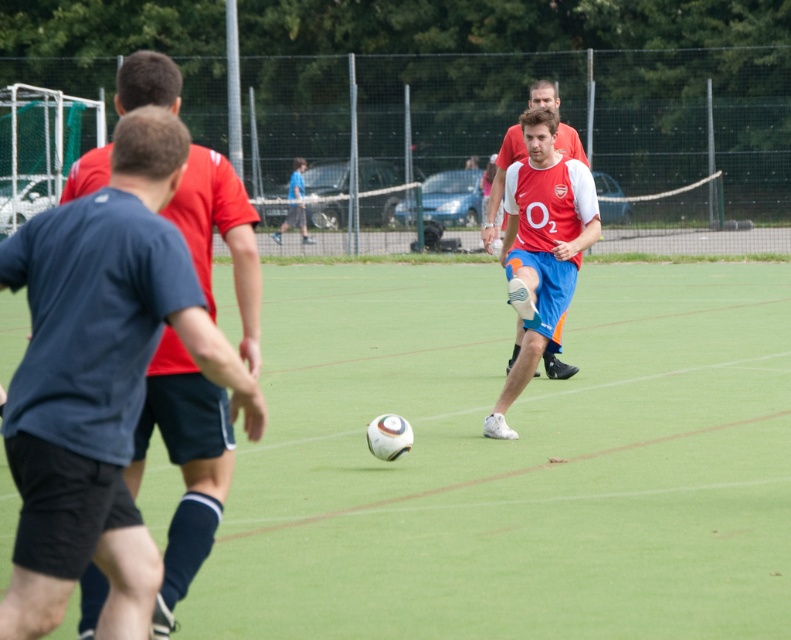
Question: Observing the image, what is the correct spatial positioning of green grass football field at center in reference to blue cotton shirt at left?

Choices:
 (A) below
 (B) above

Answer: (A)

Question: Can you confirm if green grass football field at center is positioned to the left of blue cotton shirt at left?

Choices:
 (A) no
 (B) yes

Answer: (B)

Question: Which point is farther from the camera taking this photo?

Choices:
 (A) (161, 387)
 (B) (501, 177)
 (C) (621, 307)

Answer: (C)

Question: Which point is farther to the camera?

Choices:
 (A) (498, 168)
 (B) (651, 276)
 (C) (191, 253)

Answer: (B)

Question: Which is farther from the matte red shirt at center?

Choices:
 (A) green grass football field at center
 (B) blue cotton shirt at left

Answer: (B)

Question: Is green grass football field at center above matte red shirt at center?

Choices:
 (A) no
 (B) yes

Answer: (A)